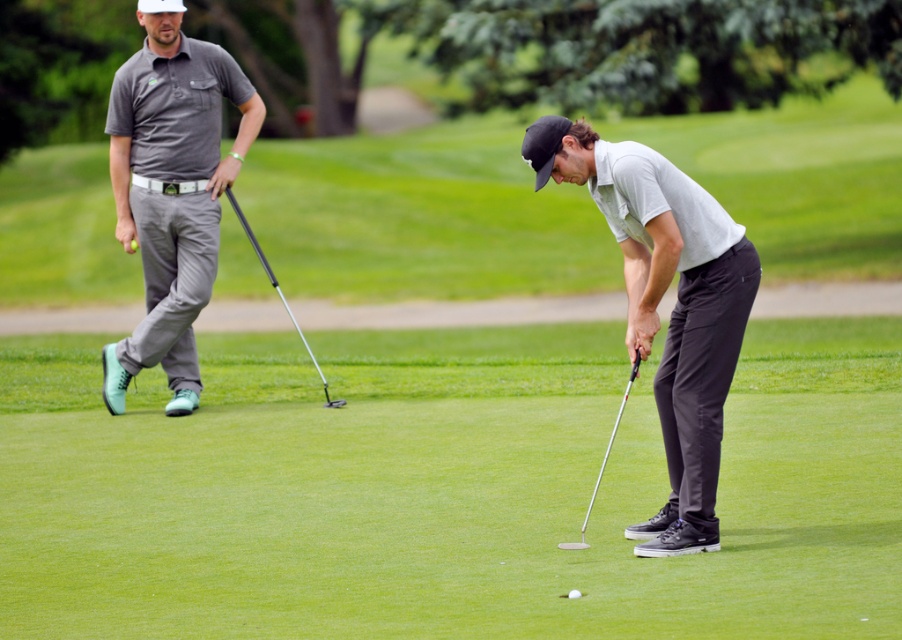
Question: Can you confirm if light gray cotton polo shirt at center is positioned above matte gray polo shirt at upper left?

Choices:
 (A) no
 (B) yes

Answer: (A)

Question: Which of the following is the farthest from the observer?

Choices:
 (A) (574, 593)
 (B) (341, 404)

Answer: (B)

Question: Does metallic silver golf club at center appear on the right side of white matte golf ball at center?

Choices:
 (A) yes
 (B) no

Answer: (B)

Question: Which point is farther to the camera?

Choices:
 (A) white matte golf ball at center
 (B) light gray cotton polo shirt at center

Answer: (B)

Question: Which point is closer to the camera?

Choices:
 (A) light gray cotton polo shirt at center
 (B) metallic silver golf club at center
 (C) matte gray polo shirt at upper left

Answer: (A)

Question: Does matte gray polo shirt at upper left lie behind metallic silver putter at center?

Choices:
 (A) yes
 (B) no

Answer: (A)